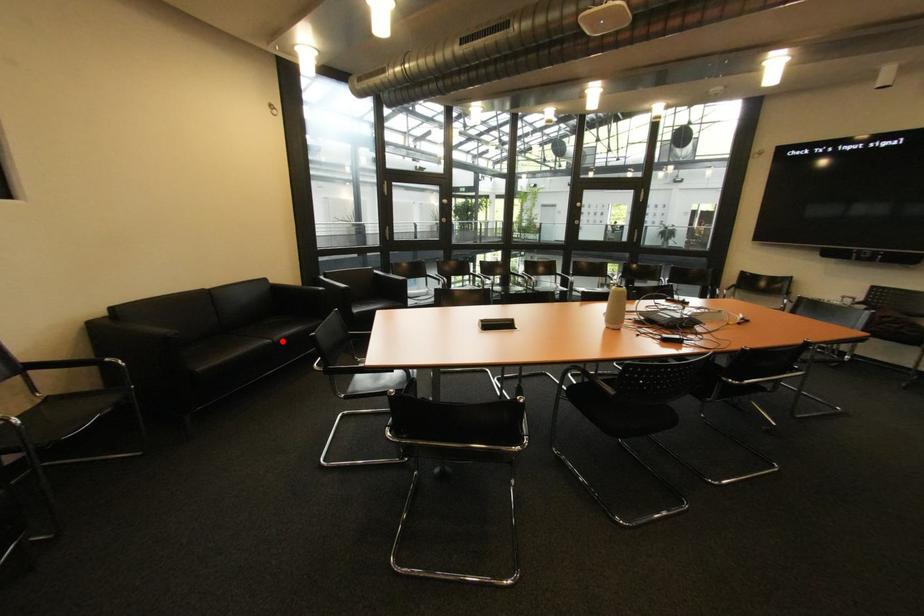
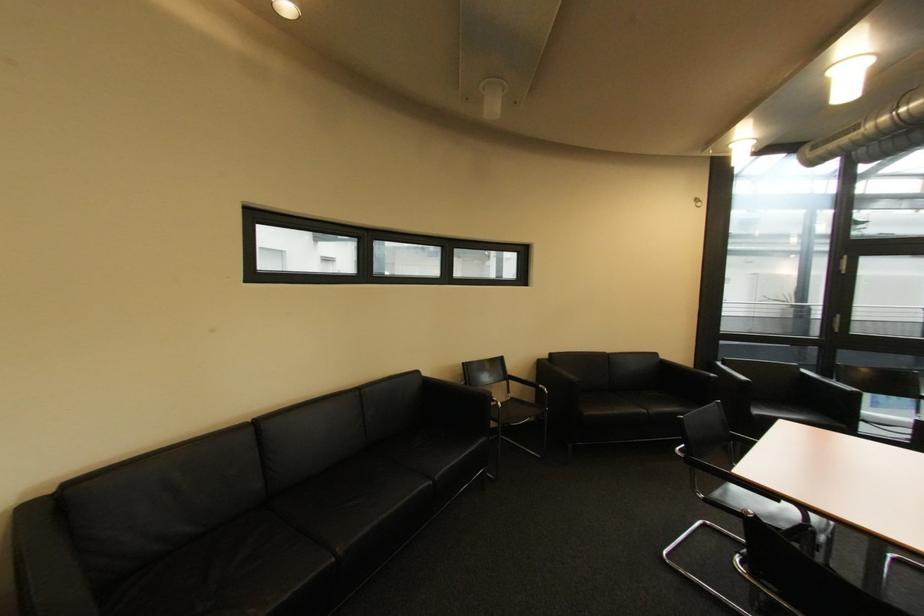
Where in the second image is the point corresponding to the highlighted location from the first image?

(658, 413)